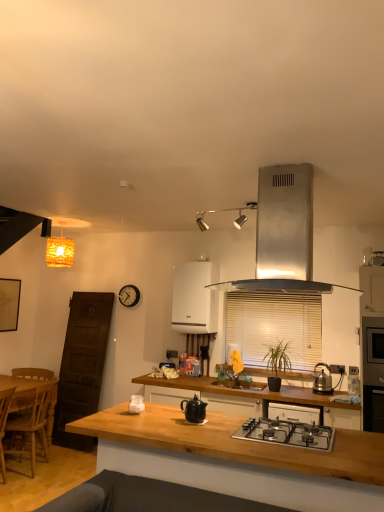
Image resolution: width=384 pixels, height=512 pixels. I want to click on free space above orange woven lampshade at upper left (from a real-world perspective), so click(69, 222).